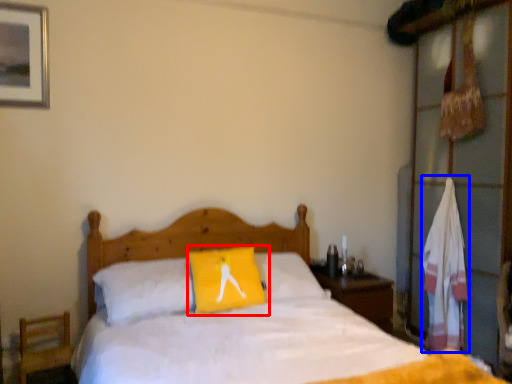
Question: Which object appears farthest to the camera in this image, pillow (highlighted by a red box) or material (highlighted by a blue box)?

Choices:
 (A) pillow
 (B) material

Answer: (B)